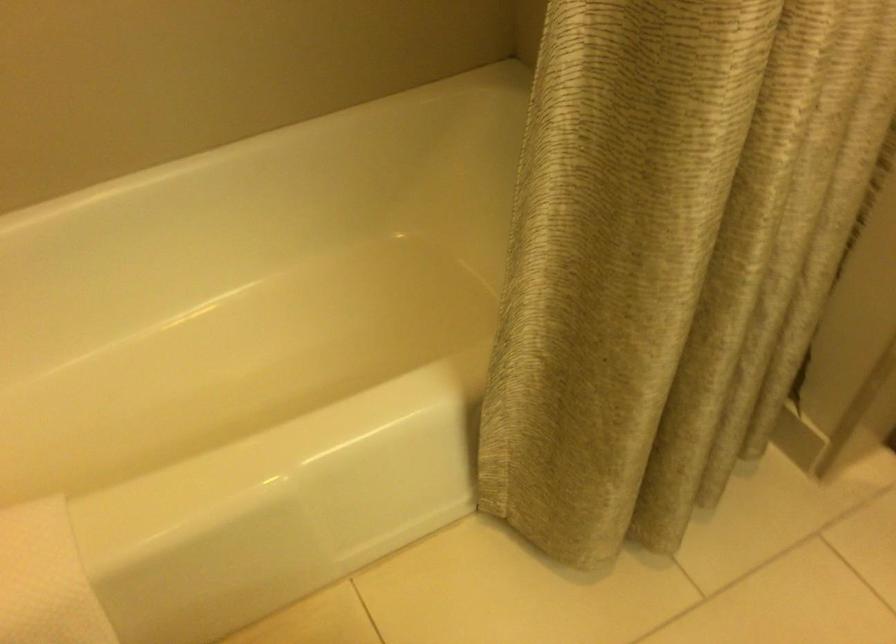
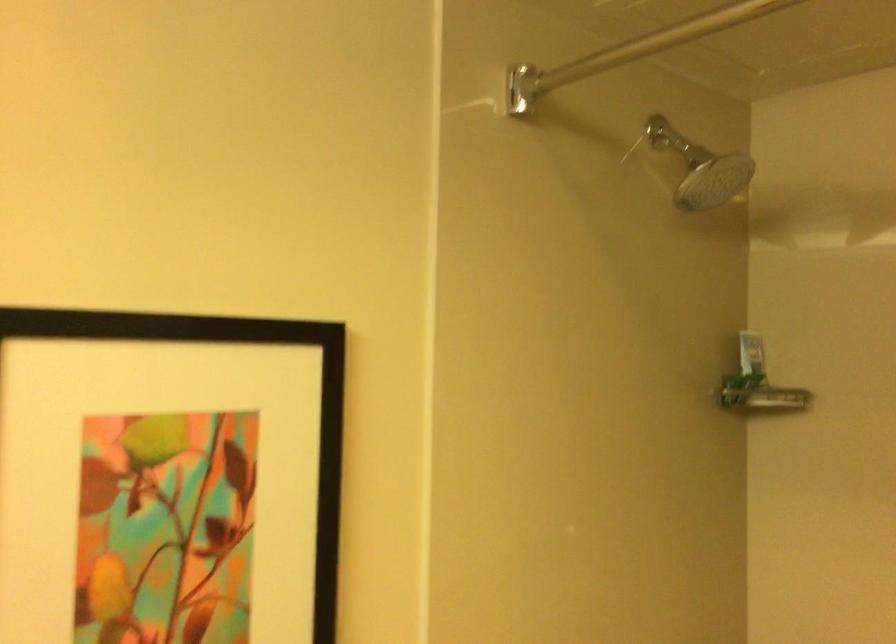
Question: The first image is from the beginning of the video and the second image is from the end. How did the camera likely rotate when shooting the video?

Choices:
 (A) Left
 (B) Right
 (C) Up
 (D) Down

Answer: (A)